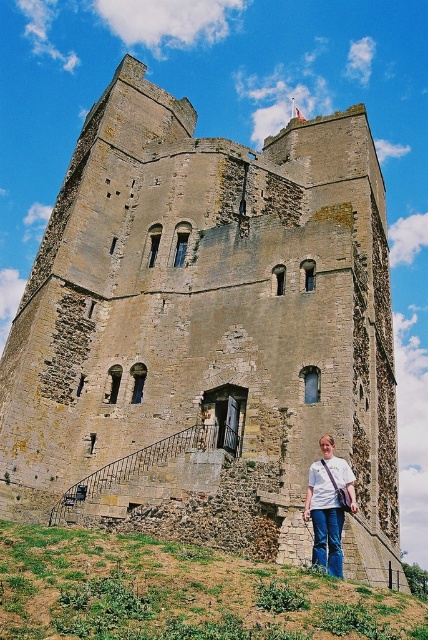
Question: Is green grassy hillside at lower left positioned behind white cotton shirt at lower center?

Choices:
 (A) yes
 (B) no

Answer: (B)

Question: Where is green grassy hillside at lower left located in relation to white cotton shirt at lower center in the image?

Choices:
 (A) left
 (B) right

Answer: (A)

Question: Which point appears closest to the camera in this image?

Choices:
 (A) (234, 580)
 (B) (338, 515)

Answer: (A)

Question: Which point appears farthest from the camera in this image?

Choices:
 (A) (338, 464)
 (B) (33, 627)

Answer: (A)

Question: Is green grassy hillside at lower left above white cotton shirt at lower center?

Choices:
 (A) no
 (B) yes

Answer: (A)